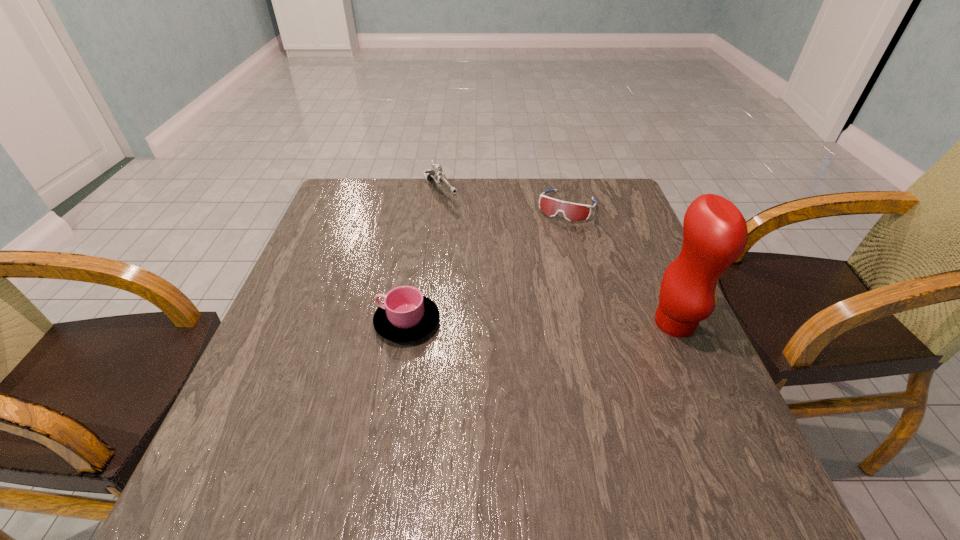
This screenshot has width=960, height=540. In order to click on vacant space at the near edge of the desktop in this screenshot , I will do (554, 417).

In the image, there is a desktop. At what (x,y) coordinates should I click in order to perform the action: click on vacant space at the left edge. Please return your answer as a coordinate pair (x, y). The image size is (960, 540). Looking at the image, I should click on (325, 283).

The height and width of the screenshot is (540, 960). In order to click on free space at the right edge of the desktop in this screenshot , I will do `click(685, 353)`.

In the image, there is a desktop. In order to click on vacant area at the far left corner in this screenshot , I will do `click(355, 188)`.

Find the location of a particular element. Image resolution: width=960 pixels, height=540 pixels. free spot at the far right corner of the desktop is located at coordinates (603, 194).

Find the location of a particular element. The height and width of the screenshot is (540, 960). vacant space at the near right corner of the desktop is located at coordinates pos(694,412).

The height and width of the screenshot is (540, 960). I want to click on unoccupied position between the third shortest object and the rightmost object, so click(558, 258).

Find the location of a particular element. This screenshot has width=960, height=540. free space that is in between the gun and the cup is located at coordinates (423, 258).

Where is `empty space between the second tallest object and the cup`? The width and height of the screenshot is (960, 540). empty space between the second tallest object and the cup is located at coordinates (423, 258).

Locate an element on the screen. Image resolution: width=960 pixels, height=540 pixels. empty location between the gun and the cup is located at coordinates (423, 258).